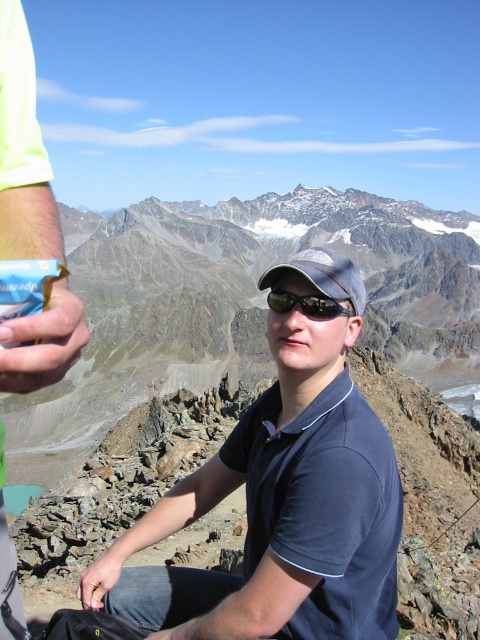
You are a photographer trying to capture the person in the image. You want to ensure the dark blue shirt at center and the dark gray fabric baseball cap at center are both clearly visible. Which object should you focus on first to ensure both are in focus?

The dark gray fabric baseball cap at center is located above the dark blue shirt at center. To ensure both are in focus, focus on the dark gray fabric baseball cap at center first since it is farther away.

You are a photographer trying to capture the exact position of the dark gray fabric baseball cap at center and the black reflective sunglasses at center. From the perspective of someone facing the person in the image, which object is positioned to the right?

The dark gray fabric baseball cap at center is positioned to the right of the black reflective sunglasses at center.